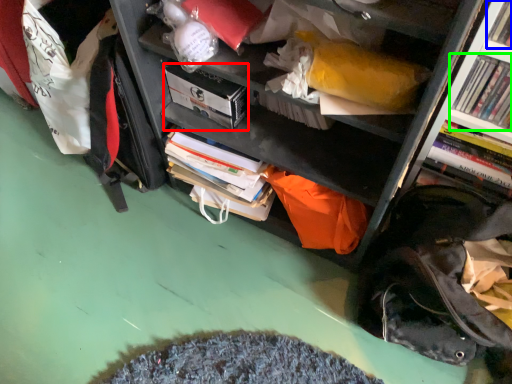
Question: Which object is the farthest from paperback book (highlighted by a red box)? Choose among these: book (highlighted by a blue box) or book (highlighted by a green box).

Choices:
 (A) book
 (B) book

Answer: (A)